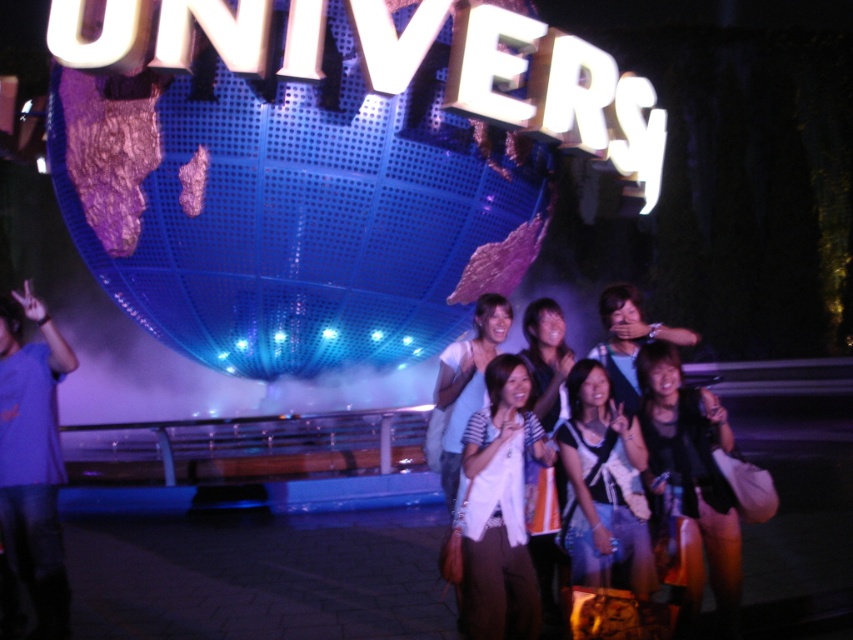
You are a photographer standing in the Universal Studios night scene. You see the white fabric at center and the white fabric shirt at center in the foreground. Can you fit both objects into your camera frame if your camera has a maximum field of view of 10 meters between objects?

The distance between the white fabric at center and the white fabric shirt at center is 11.34 meters, which exceeds the camera field of view of 10 meters. Therefore, you cannot fit both objects into the frame.

You are a photographer trying to capture a group photo at Universal Studios. The group is wearing a black leather jacket at center and a denim jacket at center. Considering the space between them, can you fit another person wearing a medium sized jacket between them?

The black leather jacket at center might be wider than denim jacket at center, so there might not be enough space to fit another person with a medium sized jacket between them.